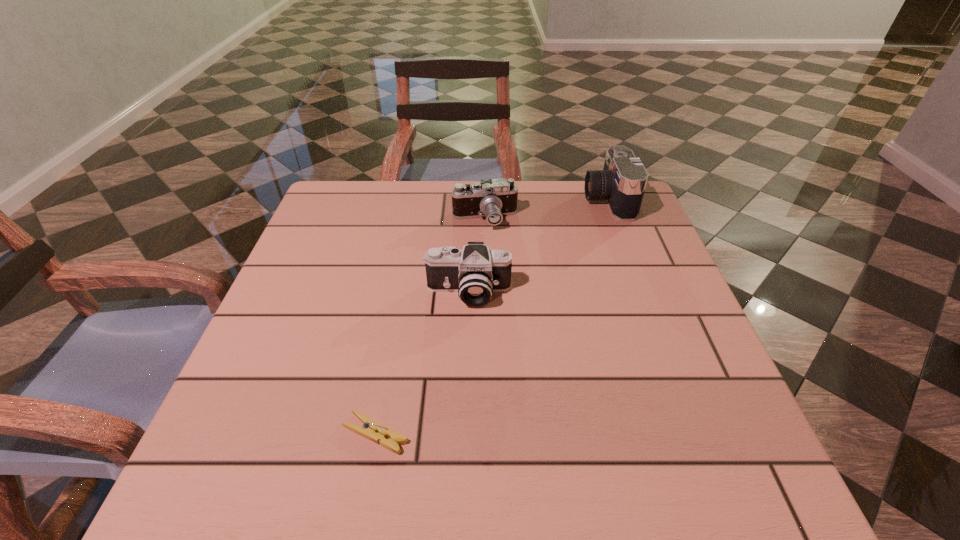
Image resolution: width=960 pixels, height=540 pixels. I want to click on free space located 0.310m on the right of the shortest object, so click(602, 434).

Locate an element on the screen. This screenshot has width=960, height=540. object that is positioned at the near edge is located at coordinates (372, 430).

This screenshot has height=540, width=960. Identify the location of object situated at the right edge. (622, 182).

Locate an element on the screen. This screenshot has height=540, width=960. object at the far right corner is located at coordinates (622, 182).

The width and height of the screenshot is (960, 540). I want to click on vacant space at the far edge of the desktop, so click(544, 206).

What are the coordinates of `free space at the near edge` in the screenshot? It's located at (628, 452).

The height and width of the screenshot is (540, 960). In order to click on free space at the left edge of the desktop in this screenshot , I will do `click(346, 232)`.

In the image, there is a desktop. What are the coordinates of `free space at the right edge` in the screenshot? It's located at (630, 370).

In the image, there is a desktop. Where is `free space at the far left corner`? The width and height of the screenshot is (960, 540). free space at the far left corner is located at coordinates (373, 225).

Image resolution: width=960 pixels, height=540 pixels. I want to click on free location at the near left corner, so click(260, 452).